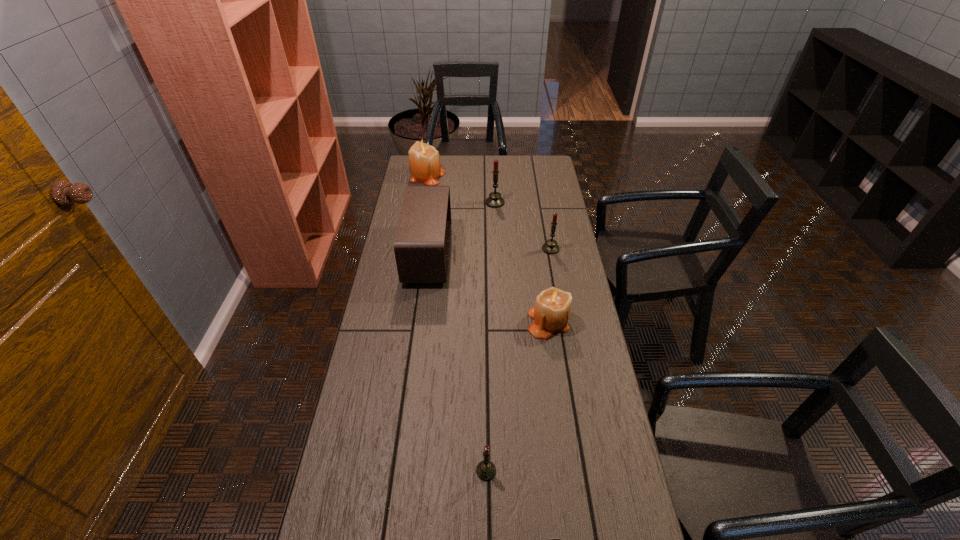
Locate an element on the screen. This screenshot has width=960, height=540. the shortest candle is located at coordinates (486, 470).

Locate an element on the screen. Image resolution: width=960 pixels, height=540 pixels. blank area located on the left of the farthest red candle is located at coordinates (430, 202).

You are a GUI agent. You are given a task and a screenshot of the screen. Output one action in this format:
    pyautogui.click(x=<x>, y=<y>)
    Task: Click on the vacant region located on the front-facing side of the radio receiver
    The height and width of the screenshot is (540, 960).
    Given the screenshot: What is the action you would take?
    pyautogui.click(x=506, y=254)

You are a GUI agent. You are given a task and a screenshot of the screen. Output one action in this format:
    pyautogui.click(x=<x>, y=<y>)
    Task: Click on the blank space located on the front of the farthest object
    The image size is (960, 540).
    Given the screenshot: What is the action you would take?
    pyautogui.click(x=420, y=219)

The width and height of the screenshot is (960, 540). In order to click on free space located on the back of the rightmost red candle in this screenshot , I will do `click(543, 210)`.

The height and width of the screenshot is (540, 960). I want to click on vacant space situated 0.150m on the front of the nearer beige candle, so click(556, 378).

In order to click on free space located 0.250m on the right of the second shortest object in this screenshot , I will do `click(590, 471)`.

Locate an element on the screen. This screenshot has height=540, width=960. object that is positioned at the far edge is located at coordinates (424, 161).

Where is `radio receiver present at the left edge`? The image size is (960, 540). radio receiver present at the left edge is located at coordinates (422, 241).

The width and height of the screenshot is (960, 540). Find the location of `candle at the left edge`. candle at the left edge is located at coordinates (424, 161).